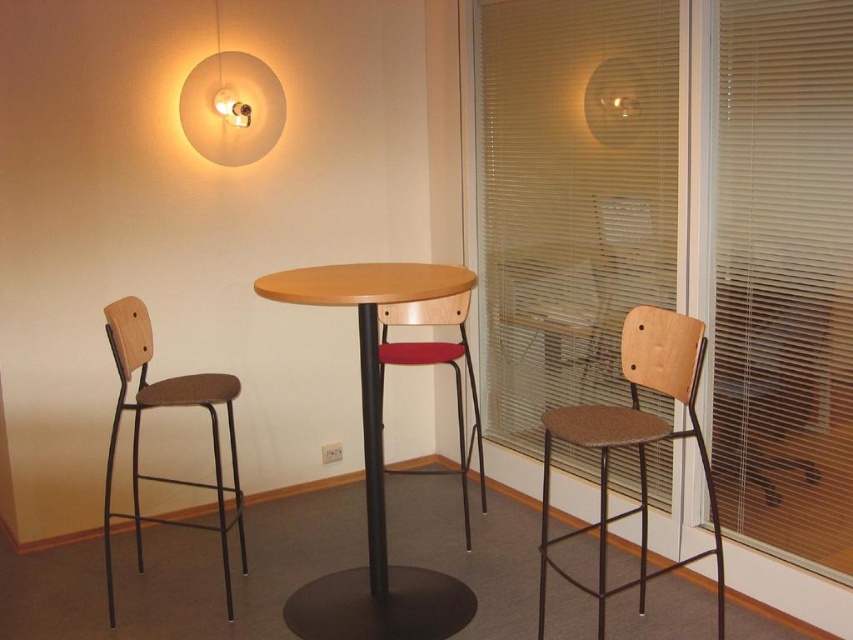
You are standing at the center of the room and want to move towards the wall where the pendant light hangs. Which point, point (437, 573) or point (604, 413), is closer to the wall behind the pendant light?

Point (437, 573) is behind point (604, 413), so it is closer to the wall behind the pendant light.